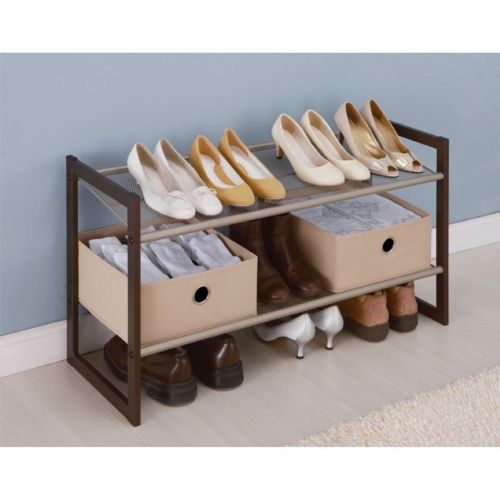
You are a GUI agent. You are given a task and a screenshot of the screen. Output one action in this format:
    pyautogui.click(x=<x>, y=<y>)
    Task: Click on the shoes on the top or middle shelf
    Image resolution: width=500 pixels, height=500 pixels.
    Given the screenshot: What is the action you would take?
    pyautogui.click(x=167, y=198), pyautogui.click(x=208, y=201), pyautogui.click(x=239, y=188), pyautogui.click(x=269, y=180), pyautogui.click(x=321, y=168), pyautogui.click(x=350, y=168), pyautogui.click(x=382, y=161), pyautogui.click(x=408, y=156), pyautogui.click(x=268, y=287), pyautogui.click(x=294, y=288)